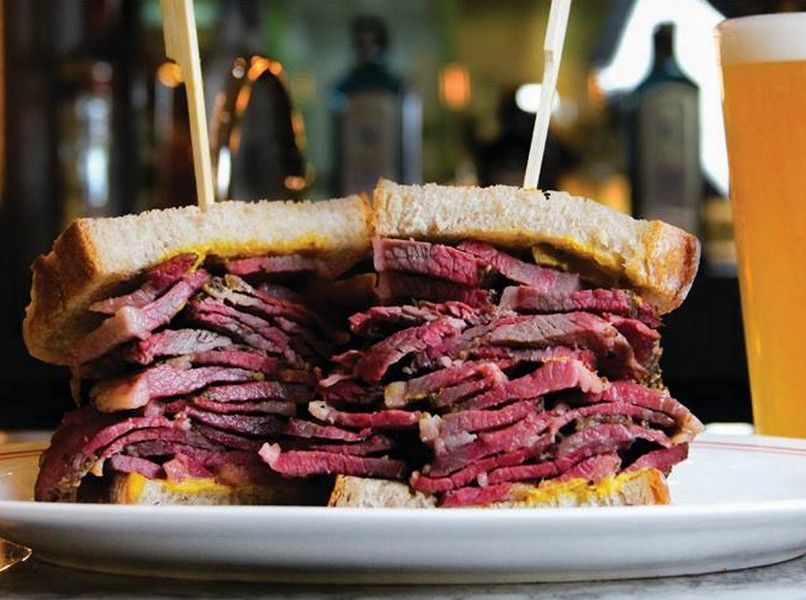
The image size is (806, 600). Find the location of `foam`. foam is located at coordinates (783, 31).